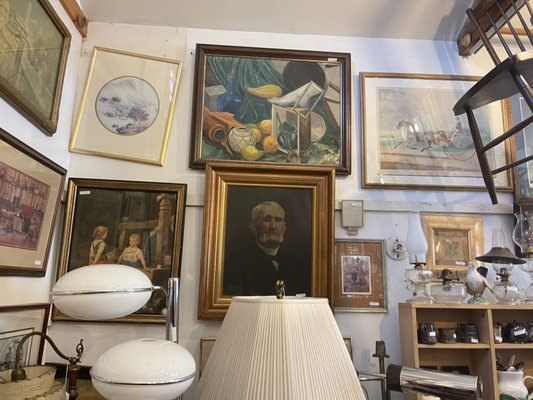
You are a GUI agent. You are given a task and a screenshot of the screen. Output one action in this format:
    pyautogui.click(x=<x>, y=<y>)
    Task: Click on the chair suspended in air
    The width and height of the screenshot is (533, 400).
    Given the screenshot: What is the action you would take?
    pyautogui.click(x=495, y=88)